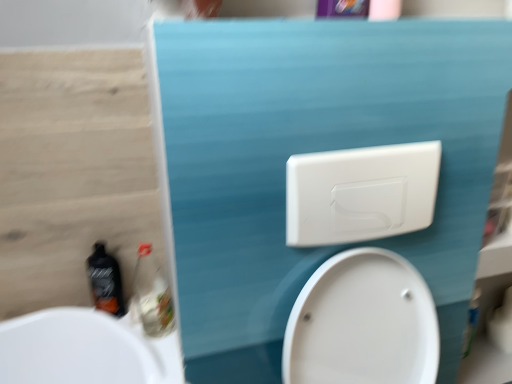
What is the approximate width of wooden at left?

The width of wooden at left is 1.23 inches.

The width and height of the screenshot is (512, 384). What do you see at coordinates (502, 324) in the screenshot?
I see `white matte toilet paper at lower right` at bounding box center [502, 324].

This screenshot has height=384, width=512. What do you see at coordinates (152, 295) in the screenshot? I see `translucent plastic bottle at lower left` at bounding box center [152, 295].

This screenshot has height=384, width=512. What are the coordinates of `wooden at left` in the screenshot? It's located at (72, 172).

Does translucent plastic bottle at lower left appear on the left side of wooden at left?

No.

Is translucent plastic bottle at lower left far from wooden at left?

No.

Considering the relative sizes of translucent plastic bottle at lower left and wooden at left in the image provided, is translucent plastic bottle at lower left shorter than wooden at left?

Yes.

From the image's perspective, is translucent plastic bottle at lower left on wooden at left?

No.

Relative to white plastic toilet flush handle at upper center, is white matte toilet paper at lower right in front or behind?

white matte toilet paper at lower right is positioned farther from the viewer than white plastic toilet flush handle at upper center.

Is white matte toilet paper at lower right positioned beyond the bounds of white plastic toilet flush handle at upper center?

Yes.

Between white matte toilet paper at lower right and white plastic toilet flush handle at upper center, which one appears on the right side from the viewer's perspective?

From the viewer's perspective, white matte toilet paper at lower right appears more on the right side.

From a real-world perspective, between white matte toilet paper at lower right and white plastic toilet flush handle at upper center, who is vertically higher?

From a 3D spatial view, white plastic toilet flush handle at upper center is above.

Is point (341, 317) closer or farther from the camera than point (170, 325)?

Point (341, 317) is closer to the camera than point (170, 325).

From the image's perspective, is white glossy toilet at center positioned above or below translucent plastic bottle at lower left?

Based on their image positions, white glossy toilet at center is located beneath translucent plastic bottle at lower left.

Is white glossy toilet at center to the left or to the right of translucent plastic bottle at lower left in the image?

In the image, white glossy toilet at center appears on the right side of translucent plastic bottle at lower left.

Considering their positions, is white glossy toilet at center located in front of or behind translucent plastic bottle at lower left?

Clearly, white glossy toilet at center is in front of translucent plastic bottle at lower left.

Could you tell me if wooden at left is turned towards black plastic bottle at lower left?

Yes, wooden at left is turned towards black plastic bottle at lower left.

Locate an element on the screen. bottle to the right of wooden at left is located at coordinates (105, 281).

How different are the orientations of wooden at left and black plastic bottle at lower left in degrees?

There is a 0.82-degree angle between the facing directions of wooden at left and black plastic bottle at lower left.

Which object is closer to the camera, white matte toilet paper at lower right or black plastic bottle at lower left?

black plastic bottle at lower left is more forward.

Which of these two, white matte toilet paper at lower right or black plastic bottle at lower left, is wider?

With larger width is white matte toilet paper at lower right.

Which of these two, white matte toilet paper at lower right or black plastic bottle at lower left, stands shorter?

white matte toilet paper at lower right.

From the image's perspective, is white matte toilet paper at lower right above or below black plastic bottle at lower left?

From the image's perspective, white matte toilet paper at lower right appears below black plastic bottle at lower left.

Looking at their sizes, would you say white matte toilet paper at lower right is wider or thinner than translucent plastic bottle at lower left?

In the image, white matte toilet paper at lower right appears to be wider than translucent plastic bottle at lower left.

Is white matte toilet paper at lower right aimed at translucent plastic bottle at lower left?

No, white matte toilet paper at lower right is not aimed at translucent plastic bottle at lower left.

From their relative heights in the image, would you say white matte toilet paper at lower right is taller or shorter than translucent plastic bottle at lower left?

Clearly, white matte toilet paper at lower right is shorter compared to translucent plastic bottle at lower left.

Is white plastic toilet flush handle at upper center at the left side of wooden at left?

In fact, white plastic toilet flush handle at upper center is to the right of wooden at left.

Is point (353, 191) positioned before point (123, 277)?

Yes.

Considering the sizes of objects white plastic toilet flush handle at upper center and wooden at left in the image provided, who is shorter, white plastic toilet flush handle at upper center or wooden at left?

white plastic toilet flush handle at upper center.

I want to click on plywood above the translucent plastic bottle at lower left (from the image's perspective), so (x=72, y=172).

This screenshot has width=512, height=384. In order to click on toilet paper located behind the white plastic toilet flush handle at upper center in this screenshot , I will do `click(502, 324)`.

Which object lies nearer to the anchor point black plastic bottle at lower left, translucent plastic bottle at lower left or white matte toilet paper at lower right?

Based on the image, translucent plastic bottle at lower left appears to be nearer to black plastic bottle at lower left.

When comparing their distances from white matte toilet paper at lower right, does white plastic toilet flush handle at upper center or black plastic bottle at lower left seem further?

Among the two, black plastic bottle at lower left is located further to white matte toilet paper at lower right.

When comparing their distances from translucent plastic bottle at lower left, does wooden at left or white glossy toilet at center seem closer?

wooden at left is closer to translucent plastic bottle at lower left.

When comparing their distances from translucent plastic bottle at lower left, does black plastic bottle at lower left or white matte toilet paper at lower right seem closer?

Among the two, black plastic bottle at lower left is located nearer to translucent plastic bottle at lower left.

From the image, which object appears to be nearer to black plastic bottle at lower left, white matte toilet paper at lower right or white glossy toilet at center?

The object closer to black plastic bottle at lower left is white glossy toilet at center.

Which object lies further to the anchor point white glossy toilet at center, white plastic toilet flush handle at upper center or translucent plastic bottle at lower left?

Based on the image, translucent plastic bottle at lower left appears to be further to white glossy toilet at center.

Considering their positions, is black plastic bottle at lower left positioned further to white glossy toilet at center than white matte toilet paper at lower right?

white matte toilet paper at lower right lies further to white glossy toilet at center than the other object.

Looking at the image, which one is located further to black plastic bottle at lower left, white plastic toilet flush handle at upper center or white glossy toilet at center?

The object further to black plastic bottle at lower left is white plastic toilet flush handle at upper center.

You are a GUI agent. You are given a task and a screenshot of the screen. Output one action in this format:
    pyautogui.click(x=<x>, y=<y>)
    Task: Click on the toilet between translucent plastic bottle at lower left and white matte toilet paper at lower right in the horizontal direction
    
    Given the screenshot: What is the action you would take?
    pyautogui.click(x=362, y=323)

Where is `light switch situated between translucent plastic bottle at lower left and white glossy toilet at center from left to right`? The image size is (512, 384). light switch situated between translucent plastic bottle at lower left and white glossy toilet at center from left to right is located at coordinates (360, 193).

Locate an element on the screen. The height and width of the screenshot is (384, 512). cleaning product between black plastic bottle at lower left and white plastic toilet flush handle at upper center is located at coordinates (152, 295).

Identify the location of cleaning product between wooden at left and white plastic toilet flush handle at upper center. (152, 295).